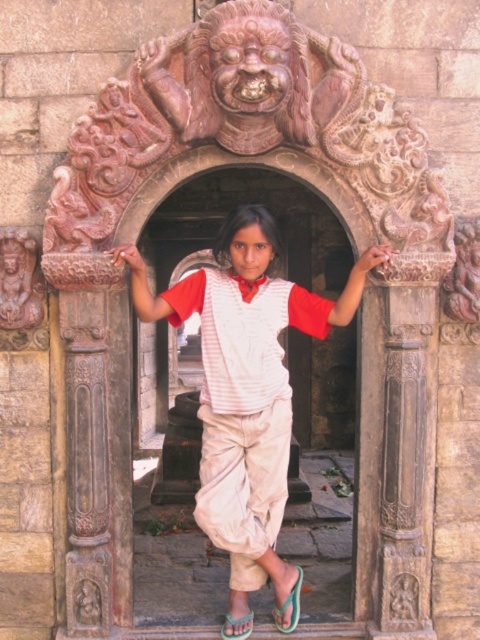
Can you confirm if white cotton shirt at center is thinner than green rubber sandal at lower center?

In fact, white cotton shirt at center might be wider than green rubber sandal at lower center.

Is white cotton shirt at center bigger than green rubber sandal at lower center?

Indeed, white cotton shirt at center has a larger size compared to green rubber sandal at lower center.

Is point (274, 253) more distant than point (242, 624)?

Yes.

At what (x,y) coordinates should I click in order to perform the action: click on white cotton shirt at center. Please return your answer as a coordinate pair (x, y). The image size is (480, 640). Looking at the image, I should click on (245, 385).

Can you confirm if green fabric sandal at lower center is thinner than green rubber sandal at lower center?

Yes, green fabric sandal at lower center is thinner than green rubber sandal at lower center.

Is point (298, 621) positioned in front of point (220, 634)?

No, (298, 621) is behind (220, 634).

Between point (291, 600) and point (252, 612), which one is positioned behind?

Point (252, 612)

The image size is (480, 640). What are the coordinates of `green fabric sandal at lower center` in the screenshot? It's located at (290, 605).

Which is behind, point (264, 349) or point (295, 620)?

The point (295, 620) is behind.

Is point (266, 358) more distant than point (277, 621)?

No.

Where is `white cotton shirt at center`? The image size is (480, 640). white cotton shirt at center is located at coordinates (245, 385).